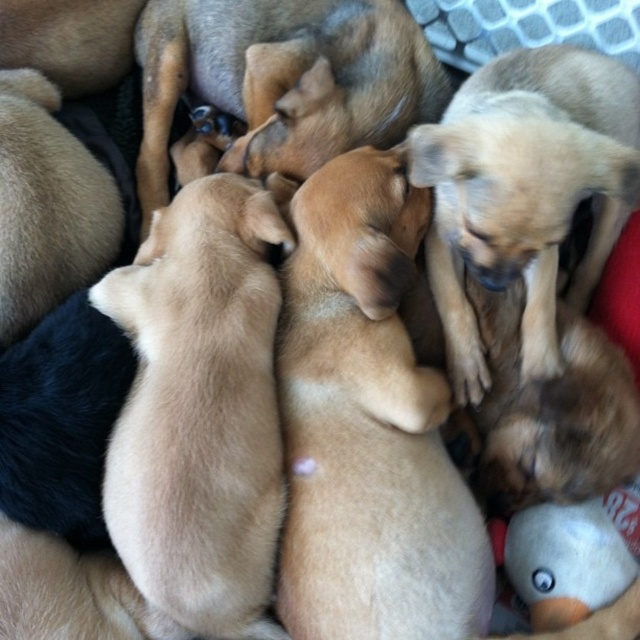
Question: Can you confirm if light brown fur at upper right is smaller than light brown fur at center?

Choices:
 (A) yes
 (B) no

Answer: (B)

Question: Among these points, which one is farthest from the camera?

Choices:
 (A) (561, 77)
 (B) (145, 83)

Answer: (B)

Question: Can you confirm if light brown fur at upper right is thinner than light brown fur at center?

Choices:
 (A) no
 (B) yes

Answer: (B)

Question: Does light brown fur at upper right appear under light brown fur at center?

Choices:
 (A) yes
 (B) no

Answer: (A)